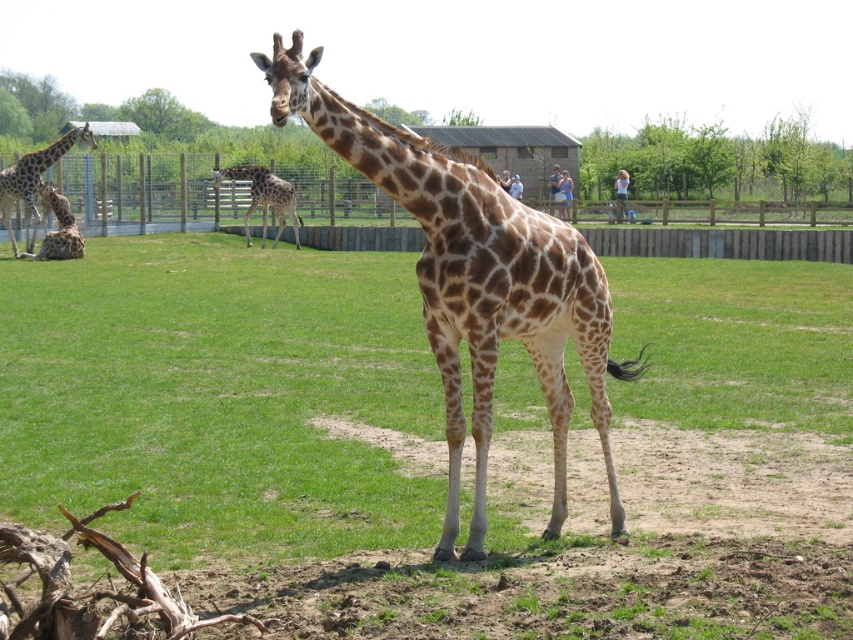
You are a photographer standing at the camera position. You want to take a closeup shot of the spotted fur giraffe at center. However, your camera can only focus on subjects within 30 meters. Can you get a clear photo?

The spotted fur giraffe at center is 32.47 meters from the camera, which is beyond the 30 meters focus range. Therefore, the camera cannot focus clearly on the giraffe.

You are a zookeeper who needs to feed the brown spotted giraffe at center. You are currently standing at the entrance of the enclosure, which is located near the wooden fence on the left side of the image. The feeding bucket is placed on a small cart 3 meters away from you. Can you reach the feeding bucket without crossing the wooden fence?

The distance between you and the feeding bucket is 3 meters, which is less than the 5.64 meters mentioned in the description. Therefore, you can reach the feeding bucket without crossing the wooden fence.